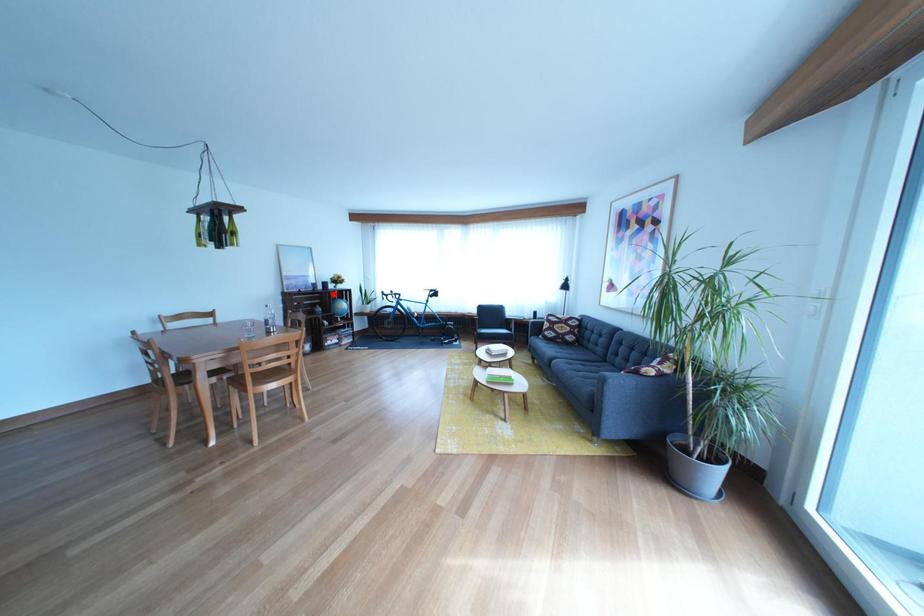
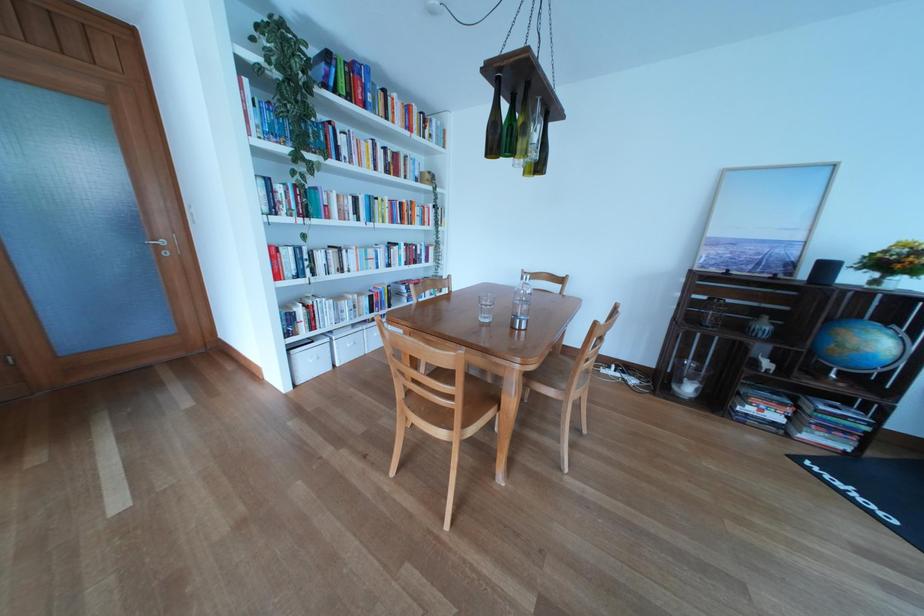
Question: I am providing you with two images of the same scene from different viewpoints. A red point is marked on the first image. Is the red point's position out of view in image 2?

Choices:
 (A) Yes
 (B) No

Answer: (B)